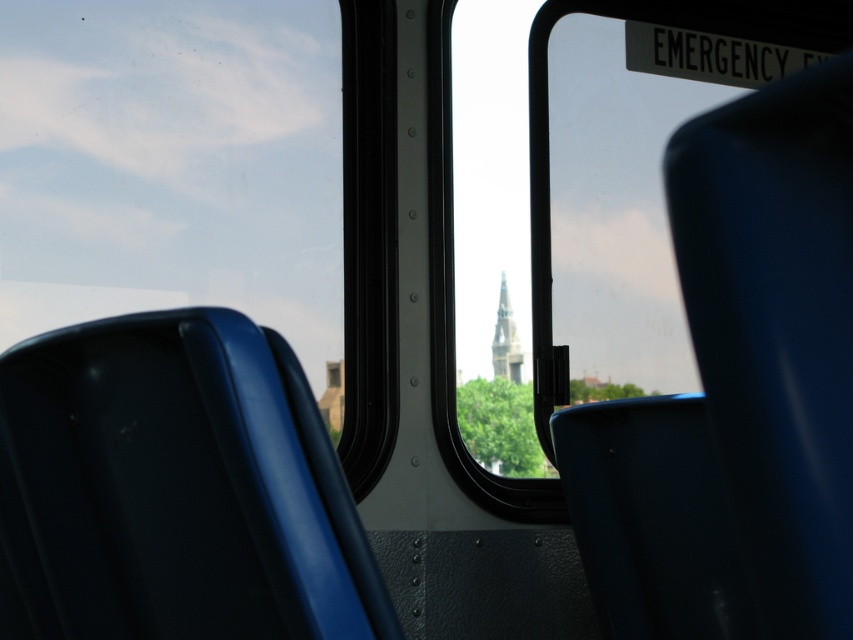
You are a passenger on a bus and see the matte blue chair at center and the smooth gray stone tower at center through the window. Which object is closer to the left side of the window?

The matte blue chair at center is to the left of the smooth gray stone tower at center, so the matte blue chair at center is closer to the left side of the window.

You are sitting in the vehicle and want to reach the matte blue chair at center to retrieve a bag you left there. Considering your arm length is 0.7 meters, can you reach it without moving from your current seat?

The matte blue chair at center is 1.12 meters away from the viewer, which is farther than your arm length of 0.7 meters. You cannot reach it without moving from your current seat.

You are a passenger sitting in the bus and want to know if the matte blue chair at center is taller than the smooth gray stone tower at center outside. Can you determine this based on the view from the windows?

The matte blue chair at center is much taller than the smooth gray stone tower at center, so yes, the matte blue chair at center is taller.